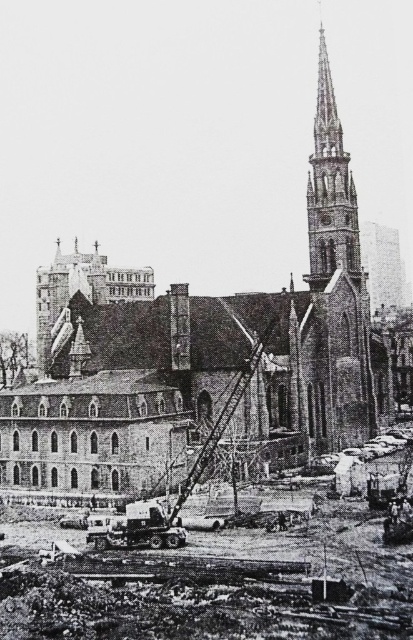
You are standing at the construction site of the Gothic church and want to reach a specific point marked as point (x=336, y=609). The safety regulations state that you must stay at least 200 feet away from the crane to avoid hazards. Can you safely approach that point?

The point (x=336, y=609) is 210.36 feet away from the viewer, which is beyond the 200 feet safety distance requirement. Therefore, you can safely approach the point as it meets the safety regulations.

Consider the image. You are an architect evaluating the construction site of a Gothic church. You notice the concrete construction site at lower center and the polished stone spire at upper right. Which of these two structures is shorter in height?

The concrete construction site at lower center has a lesser height compared to the polished stone spire at upper right, so the concrete construction site at lower center is shorter in height.

You are a construction worker who needs to move a heavy beam from the concrete construction site at lower center to the polished stone spire at upper right. Which direction should you move the beam to reach the spire?

The concrete construction site at lower center is to the left of the polished stone spire at upper right, so you should move the beam to the right to reach the spire.